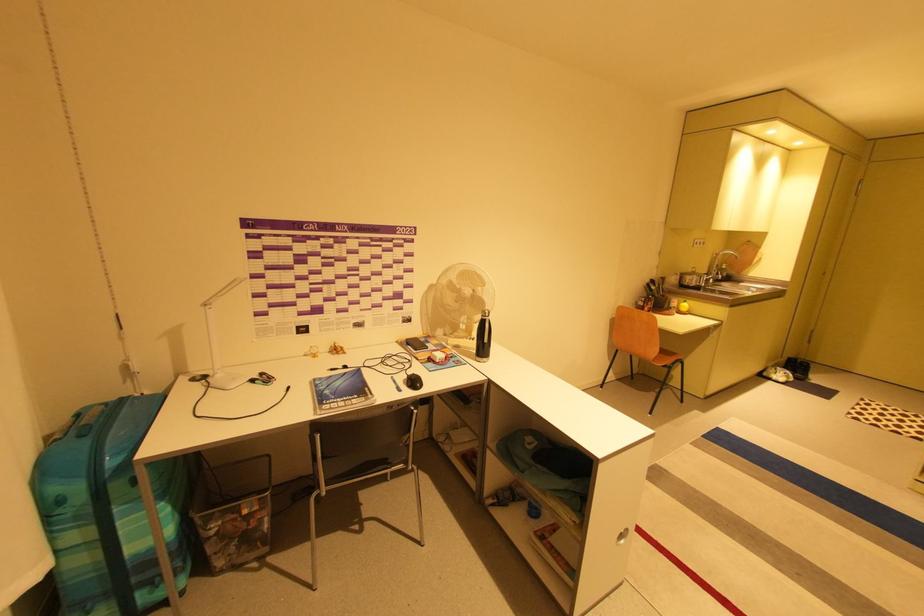
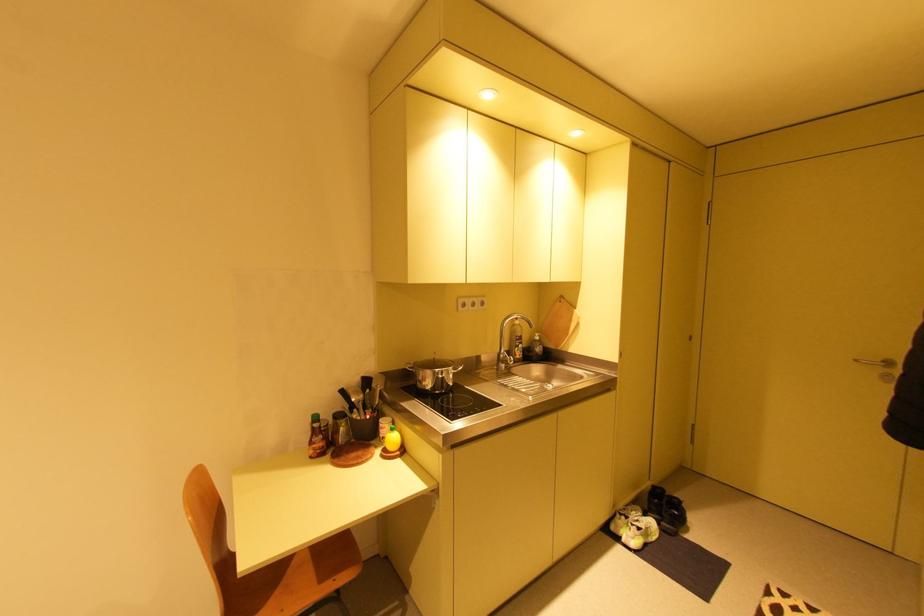
Find the pixel in the second image that matches (771,374) in the first image.

(617, 528)